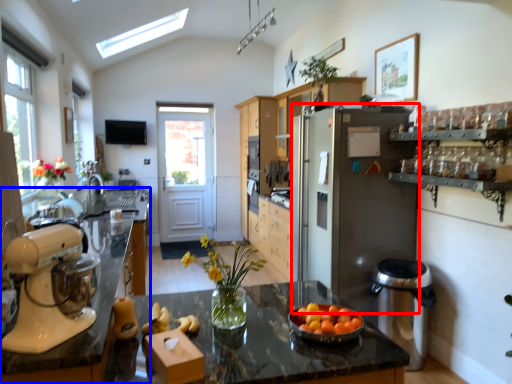
Question: Which point is further to the camera, refrigerator (highlighted by a red box) or countertop (highlighted by a blue box)?

Choices:
 (A) refrigerator
 (B) countertop

Answer: (A)